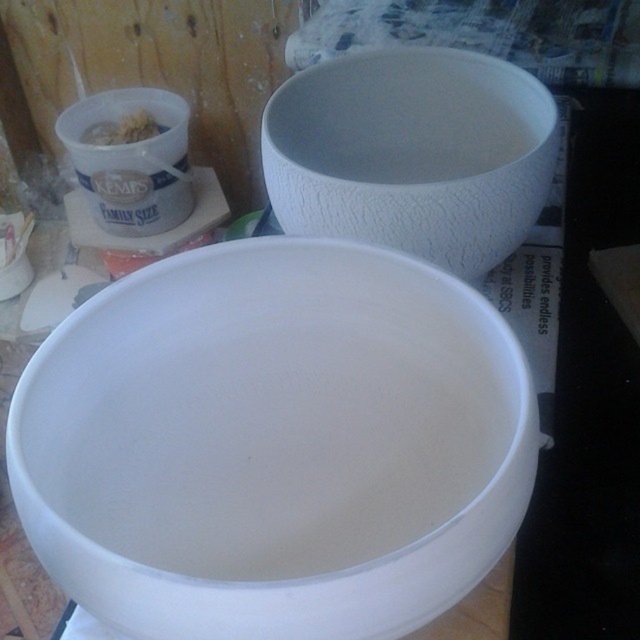
Is white matte bowl at center bigger than white textured bowl at upper center?

Yes, white matte bowl at center is bigger than white textured bowl at upper center.

Does point (362, 397) come behind point (374, 150)?

No.

The height and width of the screenshot is (640, 640). Find the location of `white matte bowl at center`. white matte bowl at center is located at coordinates (275, 444).

I want to click on white matte bowl at center, so click(275, 444).